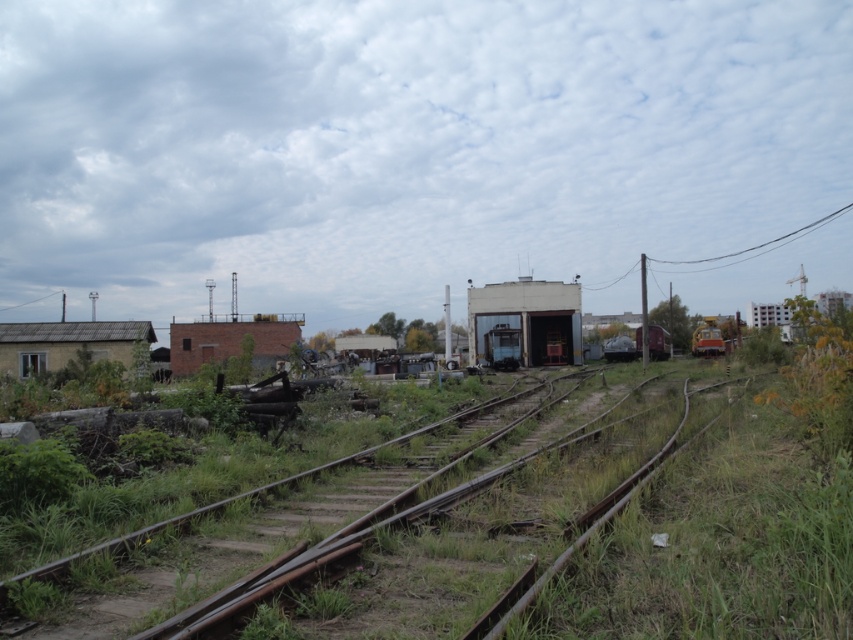
Question: Is rusty metal track at center above yellow metallic train car at right?

Choices:
 (A) no
 (B) yes

Answer: (A)

Question: Which point is farther to the camera?

Choices:
 (A) (614, 620)
 (B) (703, 339)

Answer: (B)

Question: Is rusty metal track at center bigger than yellow metallic train car at right?

Choices:
 (A) no
 (B) yes

Answer: (B)

Question: Does rusty metal track at center have a lesser width compared to yellow metallic train car at right?

Choices:
 (A) no
 (B) yes

Answer: (A)

Question: Which point appears closest to the camera in this image?

Choices:
 (A) (264, 525)
 (B) (723, 349)

Answer: (A)